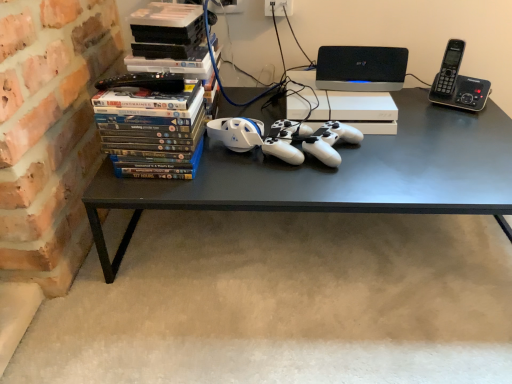
Where is `vacant area located to the right-hand side of matte plastic dvds at left`? vacant area located to the right-hand side of matte plastic dvds at left is located at coordinates (230, 178).